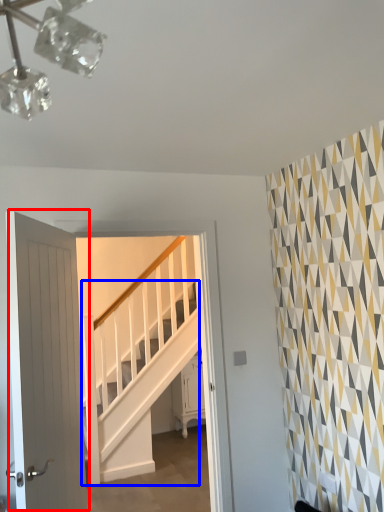
Question: Among these objects, which one is nearest to the camera, door (highlighted by a red box) or stairs (highlighted by a blue box)?

Choices:
 (A) door
 (B) stairs

Answer: (A)